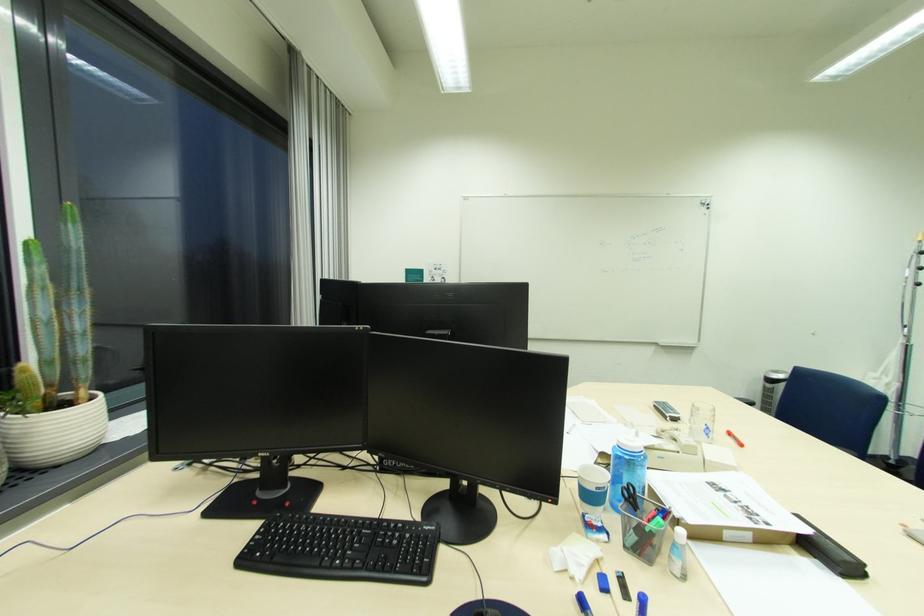
Locate an element on the screen. The width and height of the screenshot is (924, 616). cardboard box is located at coordinates (723, 507).